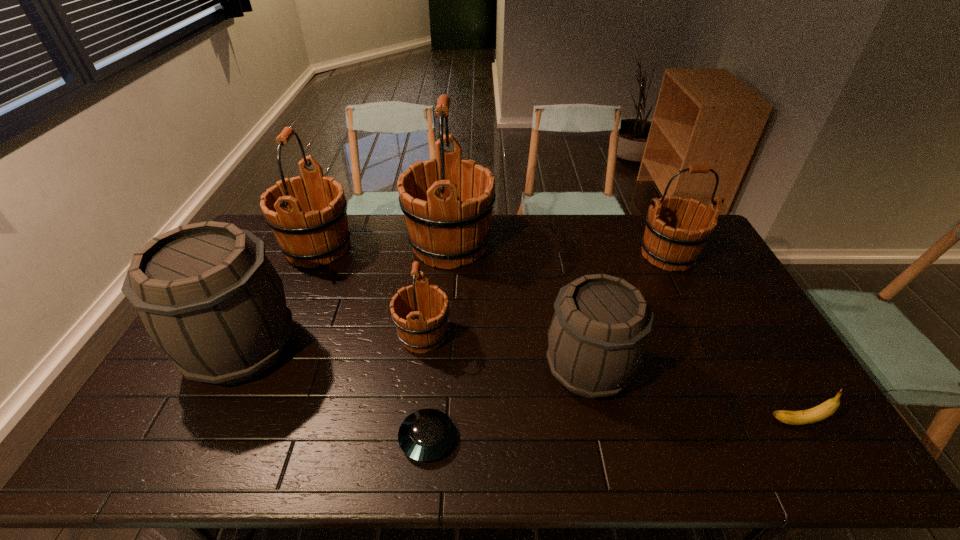
The height and width of the screenshot is (540, 960). What are the coordinates of `free space located at the start of the peel on the yellow banana` in the screenshot? It's located at (637, 422).

Find the location of a particular element. free spot located at the start of the peel on the yellow banana is located at coordinates (621, 422).

Where is `blank space located at the start of the peel on the yellow banana`? blank space located at the start of the peel on the yellow banana is located at coordinates (633, 422).

Where is `vacant space situated 0.400m on the right of the saucer`? This screenshot has width=960, height=540. vacant space situated 0.400m on the right of the saucer is located at coordinates (620, 438).

Identify the location of object that is at the near edge. (425, 435).

Identify the location of wine bucket present at the right edge. The width and height of the screenshot is (960, 540). (667, 242).

Where is `banana that is at the right edge`? This screenshot has width=960, height=540. banana that is at the right edge is located at coordinates (818, 413).

Locate an element on the screen. The height and width of the screenshot is (540, 960). object at the far left corner is located at coordinates tap(305, 237).

At what (x,y) coordinates should I click in order to perform the action: click on object at the far right corner. Please return your answer as a coordinate pair (x, y). Looking at the image, I should click on (667, 242).

At what (x,y) coordinates should I click in order to perform the action: click on vacant space at the far edge of the desktop. Please return your answer as a coordinate pair (x, y). The height and width of the screenshot is (540, 960). Looking at the image, I should click on (592, 249).